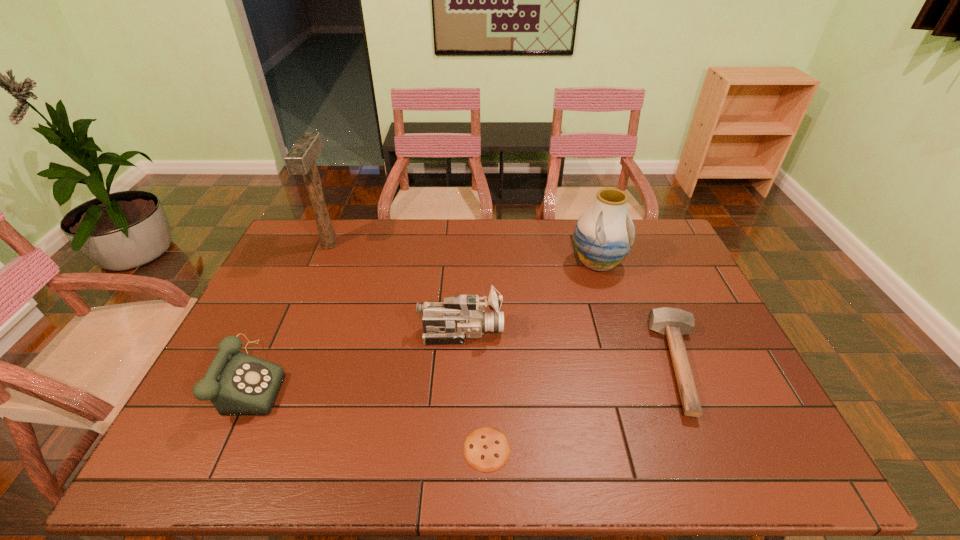
The height and width of the screenshot is (540, 960). Find the location of `unoccupied position between the fifth shortest object and the farther mallet`. unoccupied position between the fifth shortest object and the farther mallet is located at coordinates (464, 254).

Identify the location of free space between the right mallet and the second tallest object. The width and height of the screenshot is (960, 540). (640, 314).

Where is `vacant point located between the vase and the second shortest object`? The height and width of the screenshot is (540, 960). vacant point located between the vase and the second shortest object is located at coordinates (640, 314).

I want to click on vacant area that lies between the fourth shortest object and the vase, so click(530, 298).

Identify the location of empty space that is in between the taller mallet and the vase. (464, 254).

Where is `empty space that is in between the second tallest object and the nearer mallet`? Image resolution: width=960 pixels, height=540 pixels. empty space that is in between the second tallest object and the nearer mallet is located at coordinates (640, 314).

Find the location of a particular element. empty space between the nearest object and the third tallest object is located at coordinates (474, 390).

Identify which object is located as the fifth nearest to the shortest object. Please provide its 2D coordinates. Your answer should be formatted as a tuple, i.e. [(x, y)], where the tuple contains the x and y coordinates of a point satisfying the conditions above.

[(300, 160)]

Find the location of `object that is the fourth closest to the nearest object`. object that is the fourth closest to the nearest object is located at coordinates (604, 234).

Identify the location of blank space that satisfies the following two spatial constraints: 1. on the front side of the second tallest object; 2. on the dial of the fourth tallest object. (635, 380).